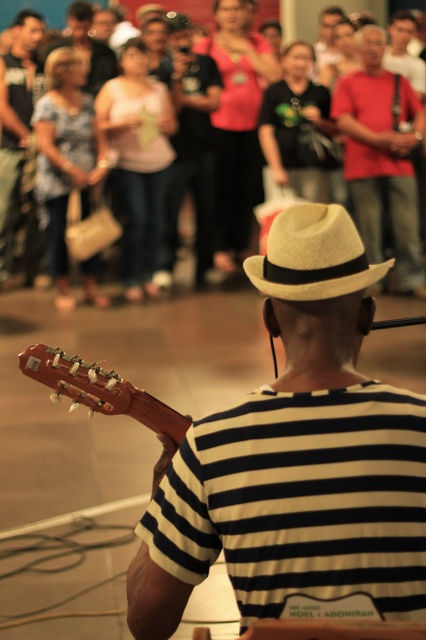
You are a photographer at the event and want to capture a photo that includes both the matte black shirt at upper left and the woolen fedora at center. Based on their positions, which object should you focus on first to ensure both are in frame?

The matte black shirt at upper left is above the woolen fedora at center, so you should focus on the woolen fedora at center first to ensure both are in frame.

You are a photographer at the event and want to capture a closeup of the musician. Since the white straw hat at center and the black matte shirt at center are both in the frame, which one is more likely to be fully visible in the photo?

The white straw hat at center is shorter than the black matte shirt at center, so the black matte shirt at center will be more fully visible in the photo since it is taller and likely extends further into the frame.

You are a photographer trying to capture the musician and their clothing details. You notice the matte black shirt at upper left and the woolen fedora at center. Which clothing item is located to the left of the other?

The matte black shirt at upper left is positioned on the left side of woolen fedora at center.